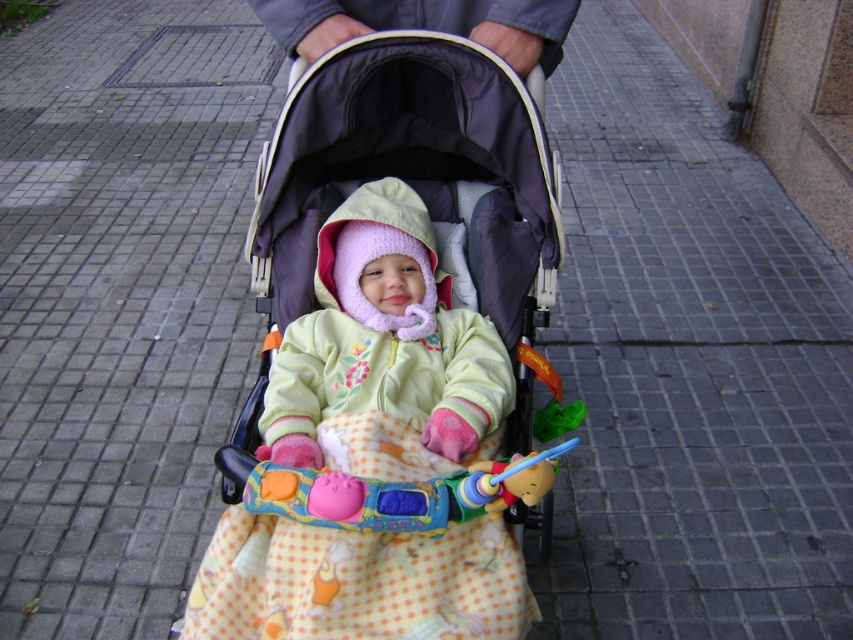
Question: From the image, what is the correct spatial relationship of light green fleece jacket at center in relation to plastic colorful toy at center?

Choices:
 (A) right
 (B) left

Answer: (B)

Question: Does light green fleece jacket at center have a lesser width compared to plastic colorful toy at center?

Choices:
 (A) no
 (B) yes

Answer: (B)

Question: Based on their relative distances, which object is nearer to the dark purple fabric baby carriage at center?

Choices:
 (A) plastic colorful toy at center
 (B) light green fleece jacket at center

Answer: (B)

Question: Can you confirm if light green fleece jacket at center is bigger than plastic colorful toy at center?

Choices:
 (A) no
 (B) yes

Answer: (B)

Question: Which point is closer to the camera?

Choices:
 (A) (436, 385)
 (B) (323, 492)
 (C) (189, 602)

Answer: (B)

Question: Which object appears farthest from the camera in this image?

Choices:
 (A) dark purple fabric baby carriage at center
 (B) light green fleece jacket at center

Answer: (B)